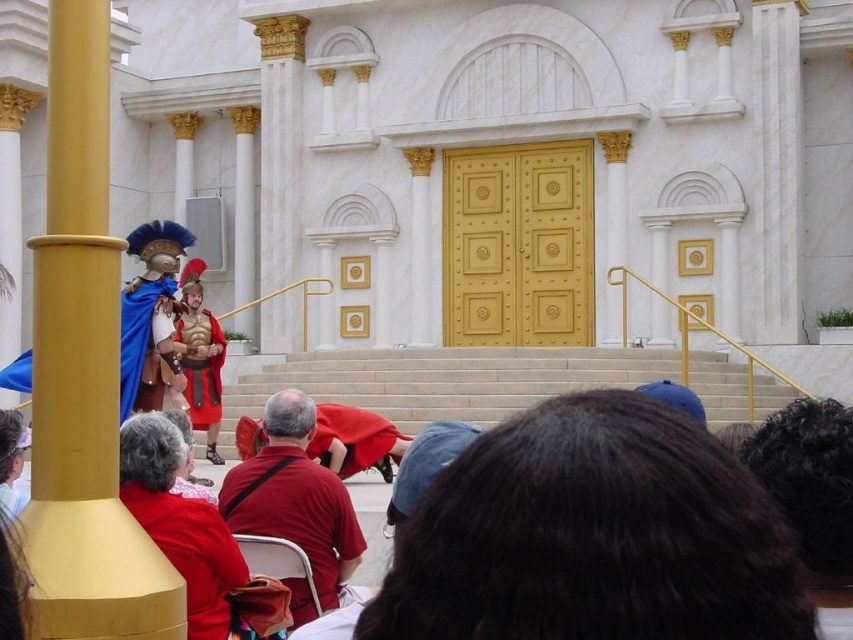
You are a photographer positioned at the bottom of the stairs. You want to take a photo of the grand building while ensuring both the velvet red cape at center and the red velvet cape at center are visible in the frame. Which cape should you focus on to make sure the other is also in the background?

You should focus on the velvet red cape at center because it is in front of the red velvet cape at center, so the latter will naturally appear in the background.

In the scene shown: You are standing at the bottom of the stairs leading to the grand classical building. You notice a velvet red cape at center. Can you estimate where it is located relative to your position?

The velvet red cape at center is located at coordinates approximately 0.864 on the x axis and 0.225 on the y axis relative to your position at the bottom of the stairs.